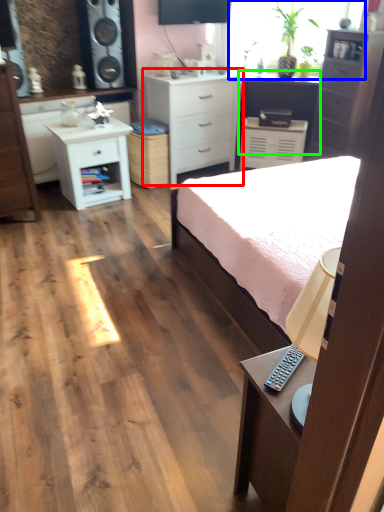
Question: Which object is positioned closest to chest of drawers (highlighted by a red box)? Select from window screen (highlighted by a blue box) and vanity (highlighted by a green box).

Choices:
 (A) window screen
 (B) vanity

Answer: (B)